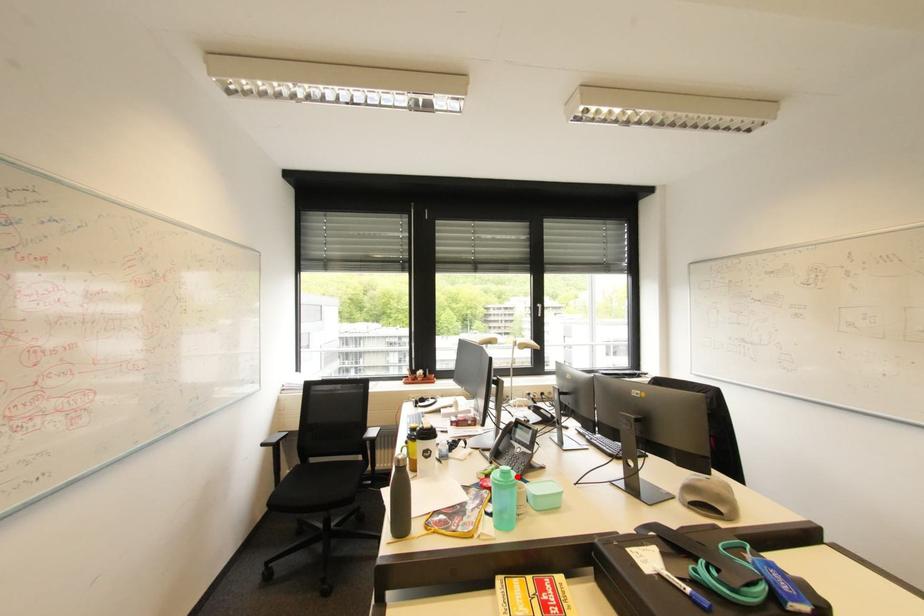
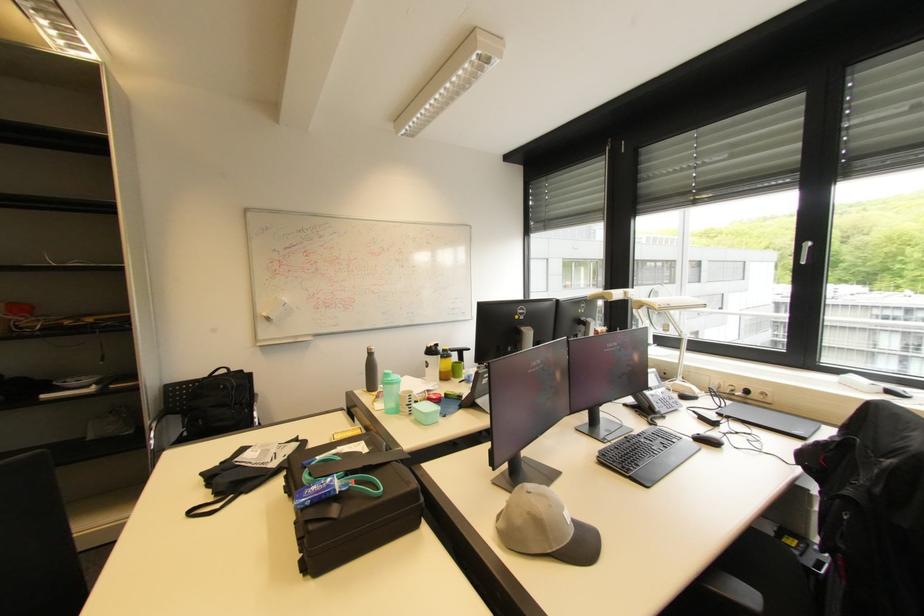
Question: I am providing you with two images of the same scene from different viewpoints. A red point is shown in image1. For the corresponding object point in image2, is it positioned nearer or farther from the camera?

Choices:
 (A) Nearer
 (B) Farther

Answer: (B)